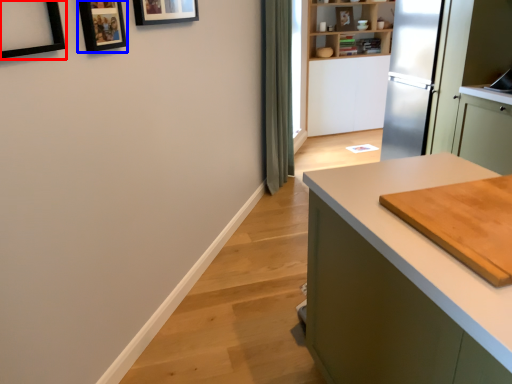
Question: Which of the following is the closest to the observer, picture frame (highlighted by a red box) or picture frame (highlighted by a blue box)?

Choices:
 (A) picture frame
 (B) picture frame

Answer: (A)